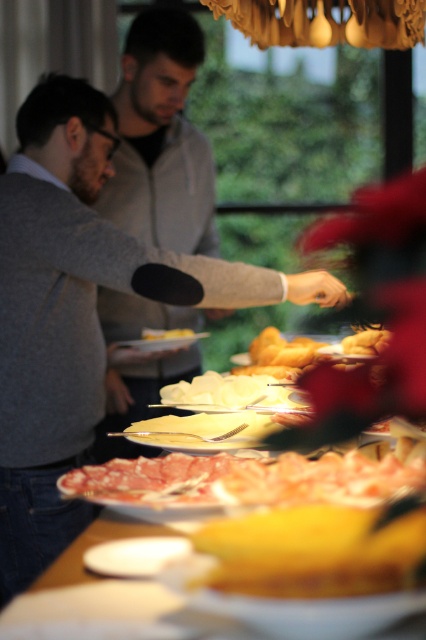
In the scene shown: You are at a buffet table and see the yellow matte bread at center and the white matte plate at center. Which item is located to the right of the other?

The yellow matte bread at center is positioned on the right side of white matte plate at center.

You are at the buffet table and want to reach both the point at coordinates [173,17] and the point at [183,333]. Which point will you reach first?

You will reach the point at coordinates [173,17] first because it is closer to you than the point at [183,333].